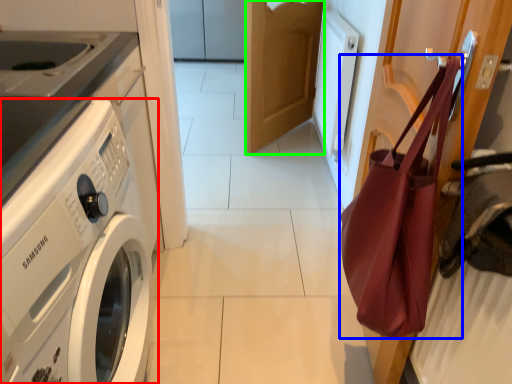
Question: Estimate the real-world distances between objects in this image. Which object is farther from washing machine (highlighted by a red box), tote bag (highlighted by a blue box) or door (highlighted by a green box)?

Choices:
 (A) tote bag
 (B) door

Answer: (B)